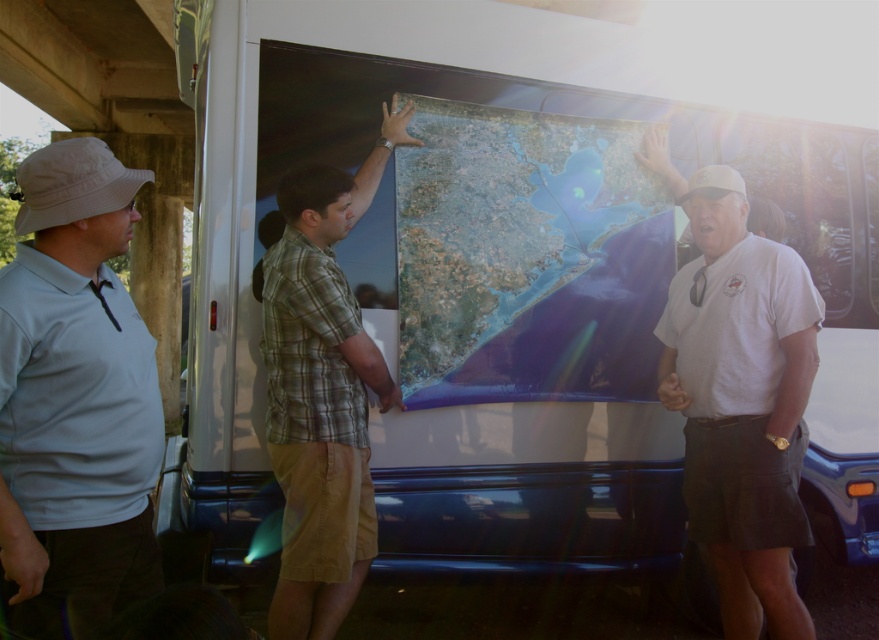
You are standing at the point with coordinates point (11, 481) and want to move towards the point with coordinates point (665, 372). Which direction should you move in relation to the other point?

You should move backward because point (11, 481) is in front of point (665, 372).

You are trying to determine which object is narrower between the white matte hat at upper left and the white cotton shirt at center. Based on the scene description, which one is thinner?

The white matte hat at upper left is thinner than the white cotton shirt at center according to the description.

You are a delivery person needing to hand over a package to the person wearing the white cotton shirt at center. The package is 22 inches wide. Can you safely pass it between you and the satiny blue map at center to reach them?

The distance between the satiny blue map at center and the white cotton shirt at center is 21.55 inches. Since the package is 22 inches wide, it is slightly wider than the available space. You may need to adjust your position or reposition the map to ensure the package can pass through safely.